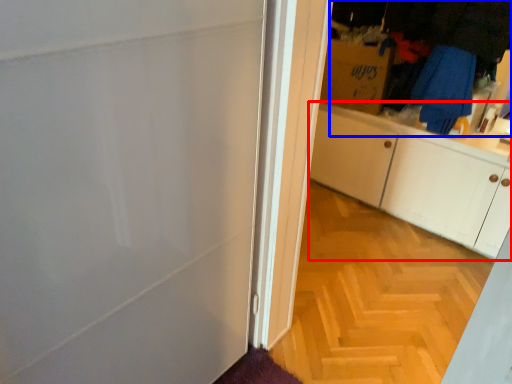
Question: Which object appears farthest to the camera in this image, cabinetry (highlighted by a red box) or laundry (highlighted by a blue box)?

Choices:
 (A) cabinetry
 (B) laundry

Answer: (B)